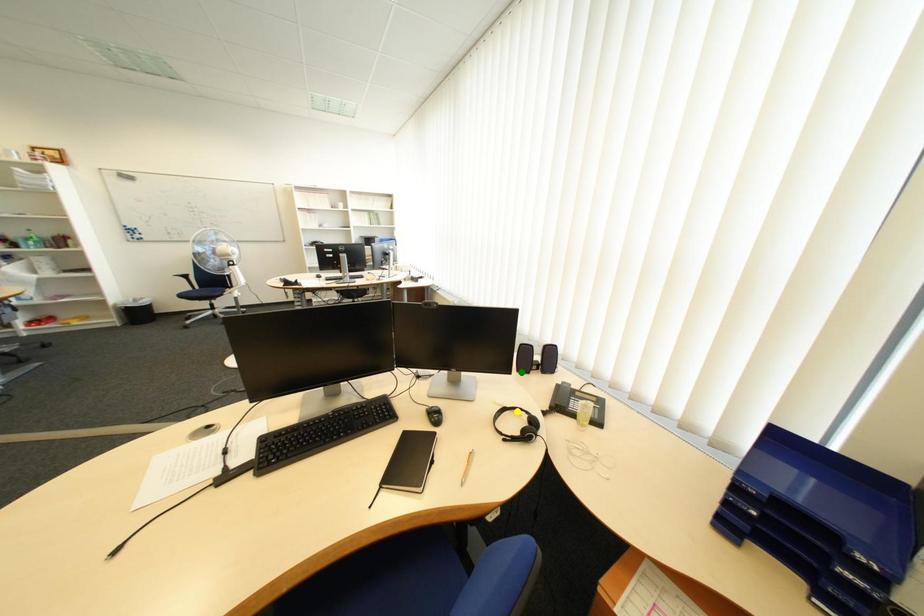
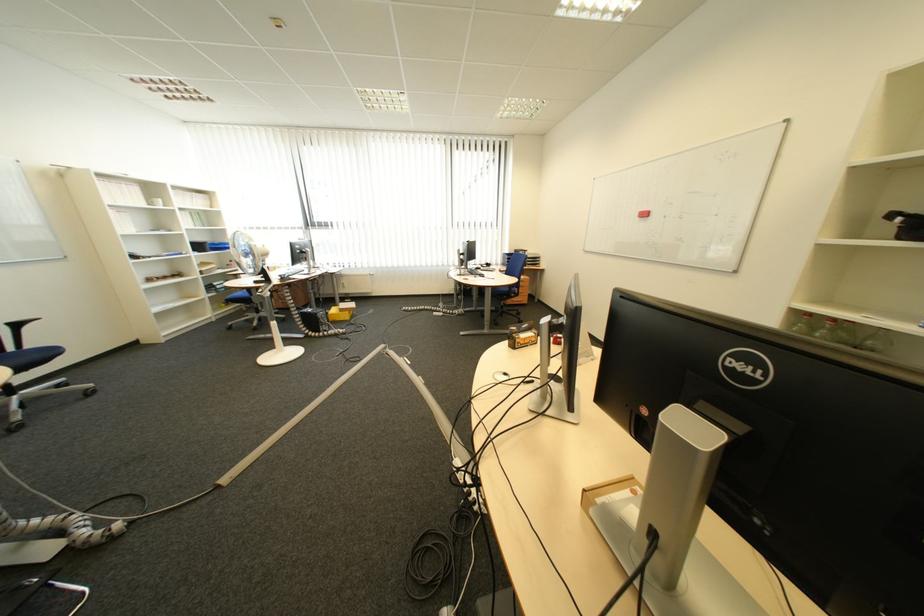
I am providing you with two images of the same scene from different viewpoints. Three points are marked in image1. Which point corresponds to a part or object that is occluded in image2?In image1, three points are marked. Which of them correspond to a part or object that is occluded in image2?Among the three points shown in image1, which one corresponds to a part or object that is no longer visible due to occlusion in image2?

Invisible in image2: green point, blue point, yellow point.